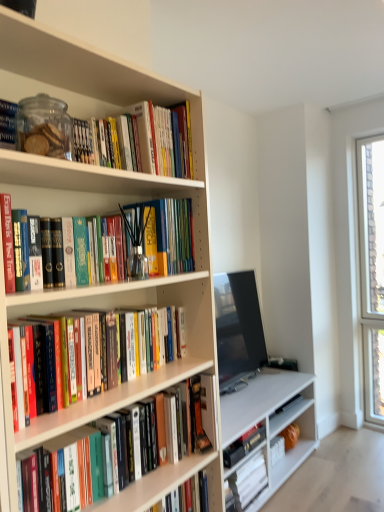
Question: From a real-world perspective, is matte black tv at center on top of hardcover book at lower center, which is the 5th book from top to bottom?

Choices:
 (A) yes
 (B) no

Answer: (A)

Question: Is matte black tv at center to the left of hardcover book at lower center, which is the 5th book from top to bottom, from the viewer's perspective?

Choices:
 (A) yes
 (B) no

Answer: (B)

Question: Could you tell me if matte black tv at center is facing hardcover book at lower center, the 3th book positioned from the bottom?

Choices:
 (A) yes
 (B) no

Answer: (B)

Question: Is matte black tv at center taller than hardcover book at lower center, the 3th book positioned from the bottom?

Choices:
 (A) no
 (B) yes

Answer: (B)

Question: From the image's perspective, is matte black tv at center on top of hardcover book at lower center, the 3th book positioned from the bottom?

Choices:
 (A) no
 (B) yes

Answer: (B)

Question: Which is correct: hardcover books at center, positioned as the fifth book in bottom-to-top order, is inside hardcover book at lower center, the first book from the bottom, or outside of it?

Choices:
 (A) inside
 (B) outside

Answer: (B)

Question: Considering the positions of point (172, 382) and point (259, 466), is point (172, 382) closer or farther from the camera than point (259, 466)?

Choices:
 (A) farther
 (B) closer

Answer: (B)

Question: From a real-world perspective, relative to hardcover book at lower center, the first book from the bottom, is hardcover books at center, placed as the 3th book when sorted from top to bottom, vertically above or below?

Choices:
 (A) below
 (B) above

Answer: (B)

Question: Is hardcover books at center, positioned as the fifth book in bottom-to-top order, taller or shorter than hardcover book at lower center, the first book from the bottom?

Choices:
 (A) tall
 (B) short

Answer: (B)

Question: Would you say hardcover book at lower center, which is the 5th book from top to bottom, is to the left or to the right of hardcover book at lower center, the first book from the bottom, in the picture?

Choices:
 (A) left
 (B) right

Answer: (A)

Question: Relative to hardcover book at lower center, which is counted as the seventh book, starting from the top, is hardcover book at lower center, the 3th book positioned from the bottom, in front or behind?

Choices:
 (A) front
 (B) behind

Answer: (A)

Question: Looking at their shapes, would you say hardcover book at lower center, the 3th book positioned from the bottom, is wider or thinner than hardcover book at lower center, which is counted as the seventh book, starting from the top?

Choices:
 (A) wide
 (B) thin

Answer: (B)

Question: Considering the positions of point (170, 501) and point (236, 493), is point (170, 501) closer or farther from the camera than point (236, 493)?

Choices:
 (A) farther
 (B) closer

Answer: (B)

Question: Based on their positions, is hardcover book at lower center, the 3th book positioned from the bottom, located to the left or right of hardcover books at center, placed as the 3th book when sorted from top to bottom?

Choices:
 (A) right
 (B) left

Answer: (A)

Question: In the image, is hardcover book at lower center, which is the 5th book from top to bottom, positioned in front of or behind hardcover books at center, positioned as the fifth book in bottom-to-top order?

Choices:
 (A) front
 (B) behind

Answer: (B)